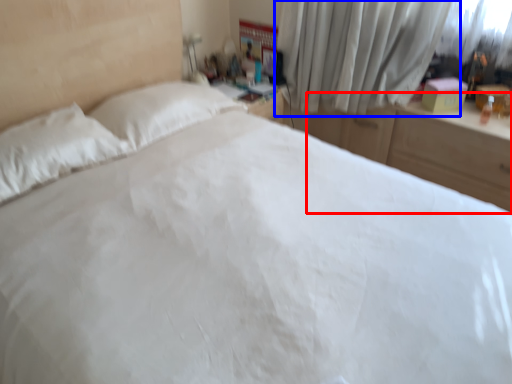
Question: Which object is further to the camera taking this photo, dresser (highlighted by a red box) or curtain (highlighted by a blue box)?

Choices:
 (A) dresser
 (B) curtain

Answer: (B)